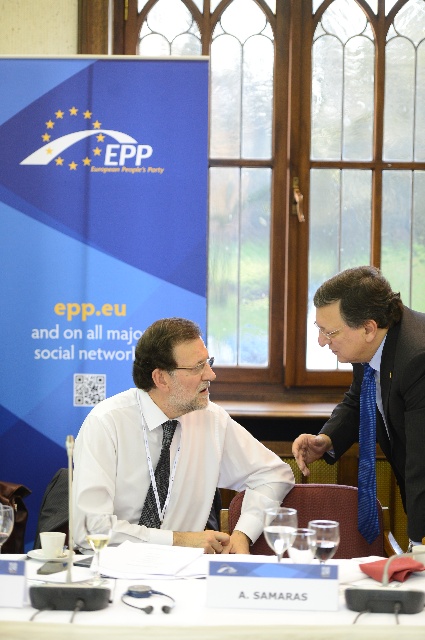
Question: Where is blue textured tie at right located in relation to black textured tie at center in the image?

Choices:
 (A) right
 (B) left

Answer: (A)

Question: Which object is closer to the camera taking this photo?

Choices:
 (A) smooth skin hand at center
 (B) blue textured tie at right

Answer: (B)

Question: Is white shirt at center in front of white paper at center?

Choices:
 (A) yes
 (B) no

Answer: (B)

Question: Which point appears closest to the camera in this image?

Choices:
 (A) (408, 380)
 (B) (79, 467)
 (C) (155, 513)

Answer: (B)

Question: Which point is farther to the camera?

Choices:
 (A) (320, 445)
 (B) (192, 637)

Answer: (A)

Question: Is blue silk suit at center in front of smooth skin hand at center?

Choices:
 (A) yes
 (B) no

Answer: (A)